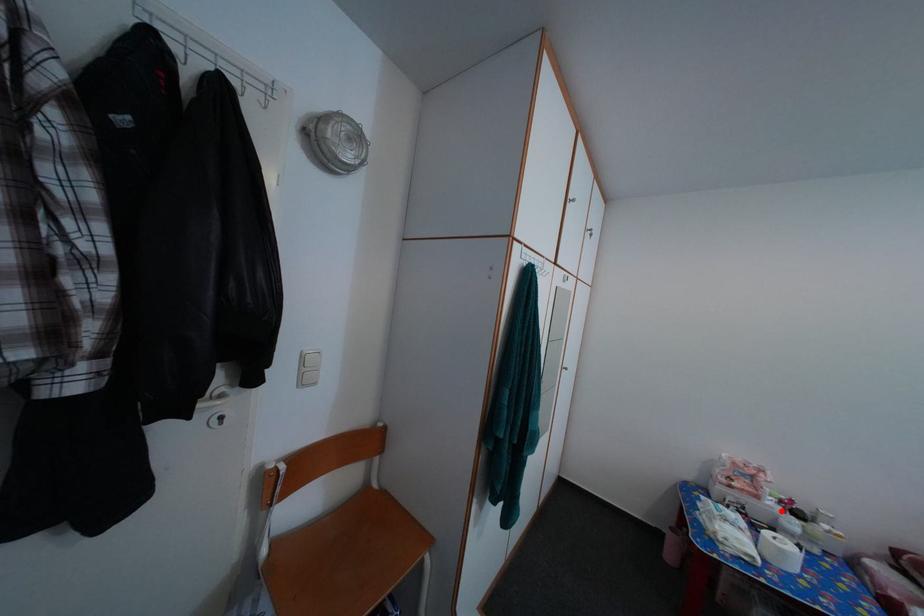
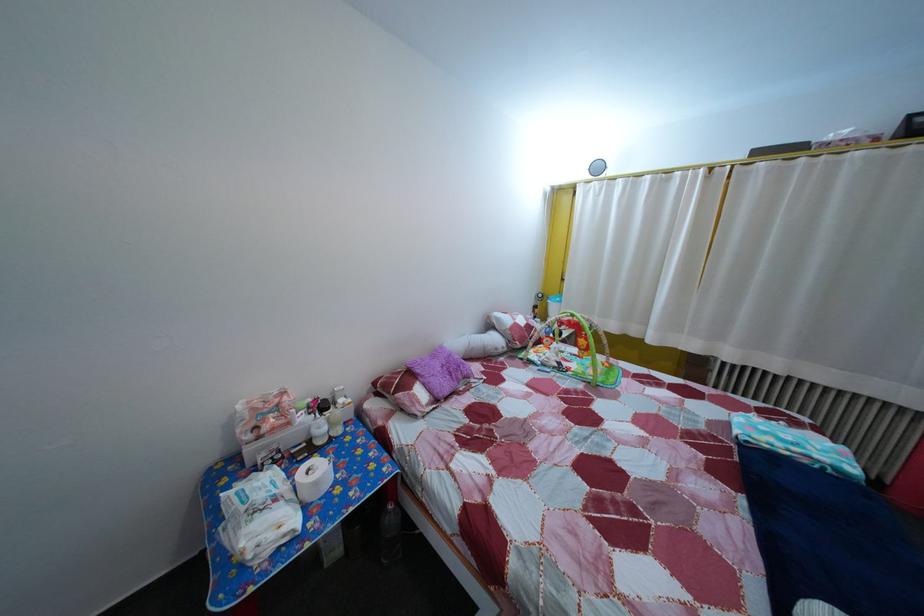
In the second image, find the point that corresponds to the highlighted location in the first image.

(311, 427)